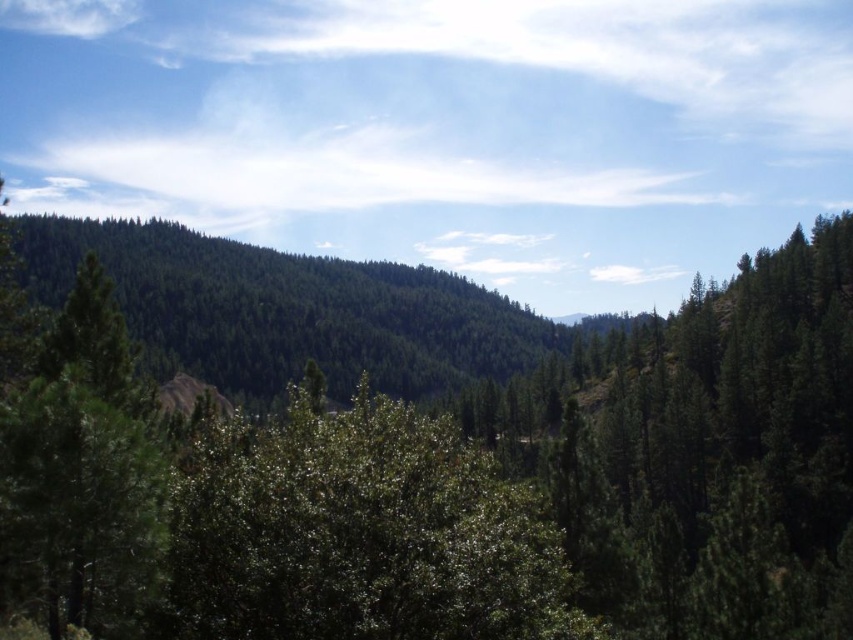
Is green leafy forest at center positioned at the back of green leafy tree at center?

No, it is in front of green leafy tree at center.

Is green leafy forest at center positioned before green leafy tree at center?

Yes, green leafy forest at center is in front of green leafy tree at center.

Does point (157, 451) come closer to viewer compared to point (311, 637)?

Yes, point (157, 451) is closer to viewer.

This screenshot has width=853, height=640. I want to click on green leafy forest at center, so click(445, 481).